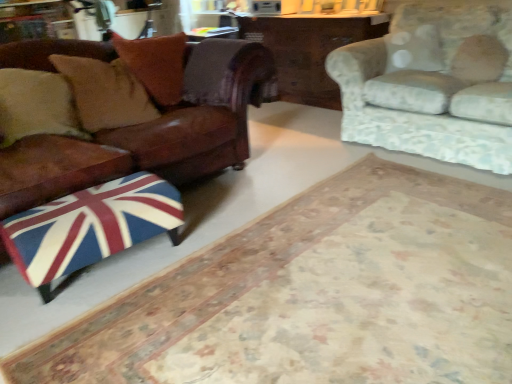
Identify the location of free point below union jack fabric ottoman at lower left (from a real-world perspective). The width and height of the screenshot is (512, 384). (111, 268).